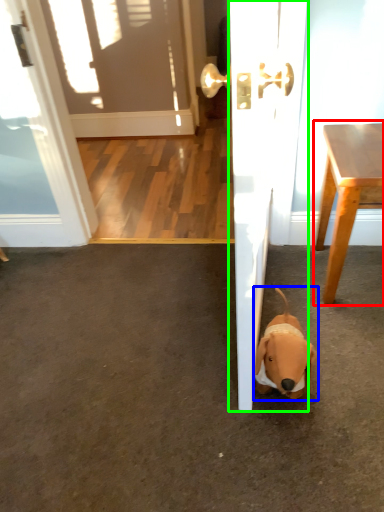
Question: Which is nearer to the table (highlighted by a red box)? dog (highlighted by a blue box) or door (highlighted by a green box).

Choices:
 (A) dog
 (B) door

Answer: (B)